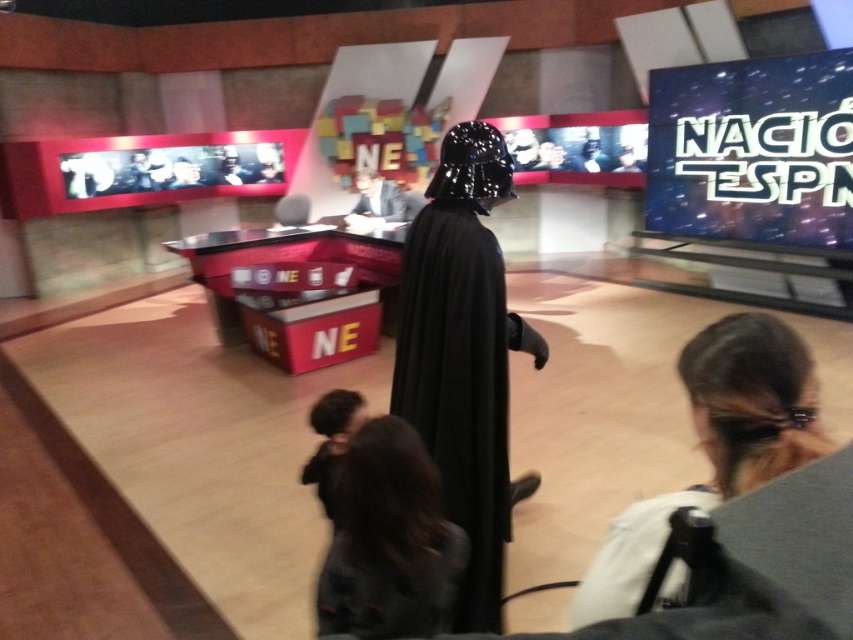
Question: Which object is the farthest from the black matte cape at center?

Choices:
 (A) black matte robe at center
 (B) dark brown hair at lower right
 (C) dark brown hair at lower center

Answer: (A)

Question: From the image, what is the correct spatial relationship of black matte cape at center in relation to dark brown hair at lower right?

Choices:
 (A) above
 (B) below

Answer: (B)

Question: Which is nearer to the black matte cape at center?

Choices:
 (A) dark brown hair at lower center
 (B) black matte robe at center

Answer: (A)

Question: Can you confirm if dark brown hair at lower right is positioned to the left of black matte robe at center?

Choices:
 (A) yes
 (B) no

Answer: (B)

Question: Is dark brown hair at lower right smaller than black matte robe at center?

Choices:
 (A) yes
 (B) no

Answer: (A)

Question: Which of these objects is positioned closest to the black matte robe at center?

Choices:
 (A) dark brown hair at lower right
 (B) dark brown hair at lower center

Answer: (B)